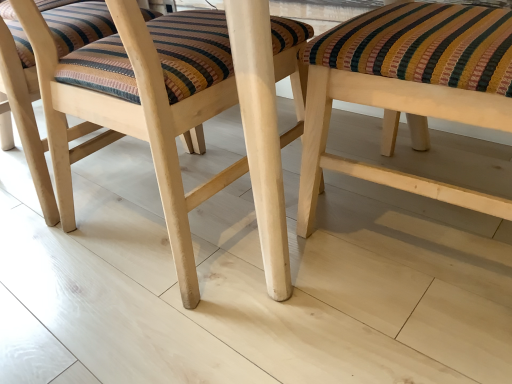
What is the approximate height of natural wood stool at center, the 2th stool from the right?

The height of natural wood stool at center, the 2th stool from the right, is 23.66 inches.

What do you see at coordinates (168, 125) in the screenshot?
I see `natural wood stool at center, the 1th stool positioned from the left` at bounding box center [168, 125].

The height and width of the screenshot is (384, 512). Identify the location of natural wood stool at center, the 2th stool from the right. (168, 125).

The image size is (512, 384). What do you see at coordinates (410, 92) in the screenshot?
I see `wooden stool at center, placed as the 1th stool when sorted from right to left` at bounding box center [410, 92].

The width and height of the screenshot is (512, 384). What are the coordinates of `wooden stool at center, placed as the 1th stool when sorted from right to left` in the screenshot? It's located at (410, 92).

You are a GUI agent. You are given a task and a screenshot of the screen. Output one action in this format:
    pyautogui.click(x=<x>, y=<y>)
    Task: Click on the natural wood stool at center, the 2th stool from the right
    
    Given the screenshot: What is the action you would take?
    pyautogui.click(x=168, y=125)

Does natural wood stool at center, the 1th stool positioned from the left, appear on the left side of wooden stool at center, placed as the 1th stool when sorted from right to left?

Correct, you'll find natural wood stool at center, the 1th stool positioned from the left, to the left of wooden stool at center, placed as the 1th stool when sorted from right to left.

Between natural wood stool at center, the 1th stool positioned from the left, and wooden stool at center, placed as the 1th stool when sorted from right to left, which one is positioned in front?

wooden stool at center, placed as the 1th stool when sorted from right to left, is more forward.

Is point (300, 105) closer or farther from the camera than point (396, 133)?

Point (300, 105) is closer to the camera than point (396, 133).

From the image's perspective, which one is positioned higher, natural wood stool at center, the 2th stool from the right, or wooden stool at center, placed as the 1th stool when sorted from right to left?

From the image's view, natural wood stool at center, the 2th stool from the right, is above.

Consider the image. From a real-world perspective, is natural wood stool at center, the 1th stool positioned from the left, on wooden stool at center, placed as the 1th stool when sorted from right to left?

Correct, in the physical world, natural wood stool at center, the 1th stool positioned from the left, is higher than wooden stool at center, placed as the 1th stool when sorted from right to left.

Is natural wood stool at center, the 1th stool positioned from the left, wider or thinner than wooden stool at center, which ranks as the 2th stool in left-to-right order?

Considering their sizes, natural wood stool at center, the 1th stool positioned from the left, looks broader than wooden stool at center, which ranks as the 2th stool in left-to-right order.

In terms of height, does natural wood stool at center, the 2th stool from the right, look taller or shorter compared to wooden stool at center, which ranks as the 2th stool in left-to-right order?

In the image, natural wood stool at center, the 2th stool from the right, appears to be taller than wooden stool at center, which ranks as the 2th stool in left-to-right order.

Considering the sizes of natural wood stool at center, the 1th stool positioned from the left, and wooden stool at center, placed as the 1th stool when sorted from right to left, in the image, is natural wood stool at center, the 1th stool positioned from the left, bigger or smaller than wooden stool at center, placed as the 1th stool when sorted from right to left,?

Considering their sizes, natural wood stool at center, the 1th stool positioned from the left, takes up more space than wooden stool at center, placed as the 1th stool when sorted from right to left.

Is natural wood stool at center, the 1th stool positioned from the left, spatially inside wooden stool at center, placed as the 1th stool when sorted from right to left, or outside of it?

natural wood stool at center, the 1th stool positioned from the left, is outside wooden stool at center, placed as the 1th stool when sorted from right to left.

Is natural wood stool at center, the 2th stool from the right, far away from wooden stool at center, placed as the 1th stool when sorted from right to left?

natural wood stool at center, the 2th stool from the right, is actually quite close to wooden stool at center, placed as the 1th stool when sorted from right to left.

Could you tell me if natural wood stool at center, the 2th stool from the right, is turned towards wooden stool at center, placed as the 1th stool when sorted from right to left?

No, natural wood stool at center, the 2th stool from the right, is not aimed at wooden stool at center, placed as the 1th stool when sorted from right to left.

How many degrees apart are the facing directions of natural wood stool at center, the 1th stool positioned from the left, and wooden stool at center, placed as the 1th stool when sorted from right to left?

The facing directions of natural wood stool at center, the 1th stool positioned from the left, and wooden stool at center, placed as the 1th stool when sorted from right to left, are 86.6 degrees apart.

Measure the distance between natural wood stool at center, the 2th stool from the right, and wooden stool at center, which ranks as the 2th stool in left-to-right order.

They are 10.38 inches apart.

This screenshot has height=384, width=512. In order to click on stool below the natural wood stool at center, the 1th stool positioned from the left (from a real-world perspective) in this screenshot , I will do `click(410, 92)`.

Considering the positions of objects wooden stool at center, which ranks as the 2th stool in left-to-right order, and natural wood stool at center, the 1th stool positioned from the left, in the image provided, who is more to the left, wooden stool at center, which ranks as the 2th stool in left-to-right order, or natural wood stool at center, the 1th stool positioned from the left,?

Positioned to the left is natural wood stool at center, the 1th stool positioned from the left.

Which object is more forward, wooden stool at center, which ranks as the 2th stool in left-to-right order, or natural wood stool at center, the 1th stool positioned from the left?

Positioned in front is wooden stool at center, which ranks as the 2th stool in left-to-right order.

Which is behind, point (322, 133) or point (115, 87)?

Positioned behind is point (322, 133).

From the image's perspective, is wooden stool at center, which ranks as the 2th stool in left-to-right order, located above or below natural wood stool at center, the 1th stool positioned from the left?

Based on their image positions, wooden stool at center, which ranks as the 2th stool in left-to-right order, is located beneath natural wood stool at center, the 1th stool positioned from the left.

From a real-world perspective, is wooden stool at center, which ranks as the 2th stool in left-to-right order, physically above natural wood stool at center, the 2th stool from the right?

No, from a real-world perspective, wooden stool at center, which ranks as the 2th stool in left-to-right order, is not on top of natural wood stool at center, the 2th stool from the right.

Is wooden stool at center, placed as the 1th stool when sorted from right to left, wider or thinner than natural wood stool at center, the 2th stool from the right?

In the image, wooden stool at center, placed as the 1th stool when sorted from right to left, appears to be more narrow than natural wood stool at center, the 2th stool from the right.

Considering the sizes of wooden stool at center, which ranks as the 2th stool in left-to-right order, and natural wood stool at center, the 2th stool from the right, in the image, is wooden stool at center, which ranks as the 2th stool in left-to-right order, taller or shorter than natural wood stool at center, the 2th stool from the right,?

In the image, wooden stool at center, which ranks as the 2th stool in left-to-right order, appears to be shorter than natural wood stool at center, the 2th stool from the right.

Consider the image. Considering the relative sizes of wooden stool at center, which ranks as the 2th stool in left-to-right order, and natural wood stool at center, the 1th stool positioned from the left, in the image provided, is wooden stool at center, which ranks as the 2th stool in left-to-right order, bigger than natural wood stool at center, the 1th stool positioned from the left,?

Actually, wooden stool at center, which ranks as the 2th stool in left-to-right order, might be smaller than natural wood stool at center, the 1th stool positioned from the left.

Is wooden stool at center, placed as the 1th stool when sorted from right to left, not within natural wood stool at center, the 1th stool positioned from the left?

Yes, wooden stool at center, placed as the 1th stool when sorted from right to left, is not within natural wood stool at center, the 1th stool positioned from the left.

Are wooden stool at center, which ranks as the 2th stool in left-to-right order, and natural wood stool at center, the 2th stool from the right, making contact?

wooden stool at center, which ranks as the 2th stool in left-to-right order, is not next to natural wood stool at center, the 2th stool from the right, and they're not touching.

Is natural wood stool at center, the 1th stool positioned from the left, at the back of wooden stool at center, which ranks as the 2th stool in left-to-right order?

That's not correct — wooden stool at center, which ranks as the 2th stool in left-to-right order, is not looking away from natural wood stool at center, the 1th stool positioned from the left.

How far apart are wooden stool at center, placed as the 1th stool when sorted from right to left, and natural wood stool at center, the 1th stool positioned from the left?

wooden stool at center, placed as the 1th stool when sorted from right to left, and natural wood stool at center, the 1th stool positioned from the left, are 10.38 inches apart from each other.

In order to click on stool behind the wooden stool at center, placed as the 1th stool when sorted from right to left in this screenshot , I will do `click(168, 125)`.

Identify the location of stool behind the wooden stool at center, placed as the 1th stool when sorted from right to left. (168, 125).

Identify the location of stool that is in front of the natural wood stool at center, the 2th stool from the right. (410, 92).